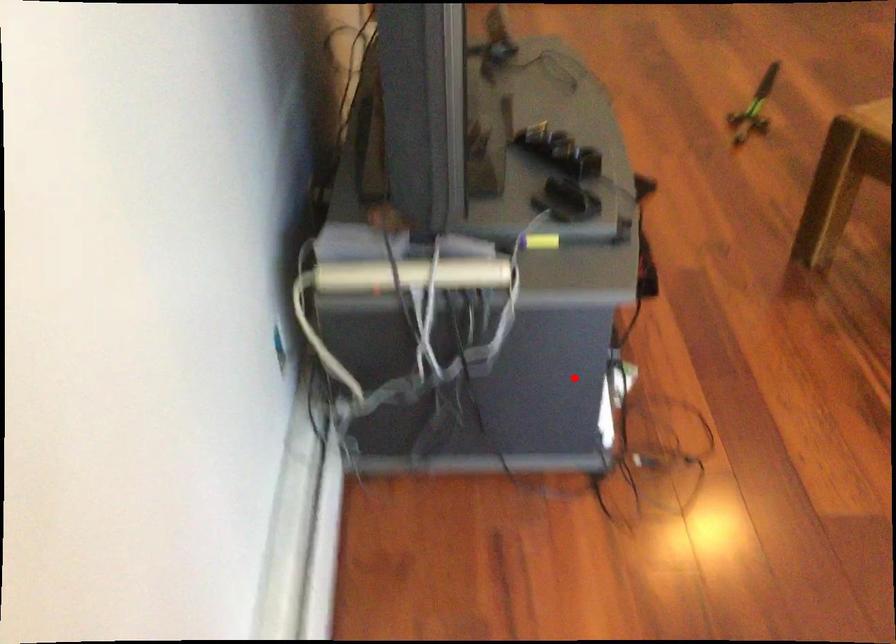
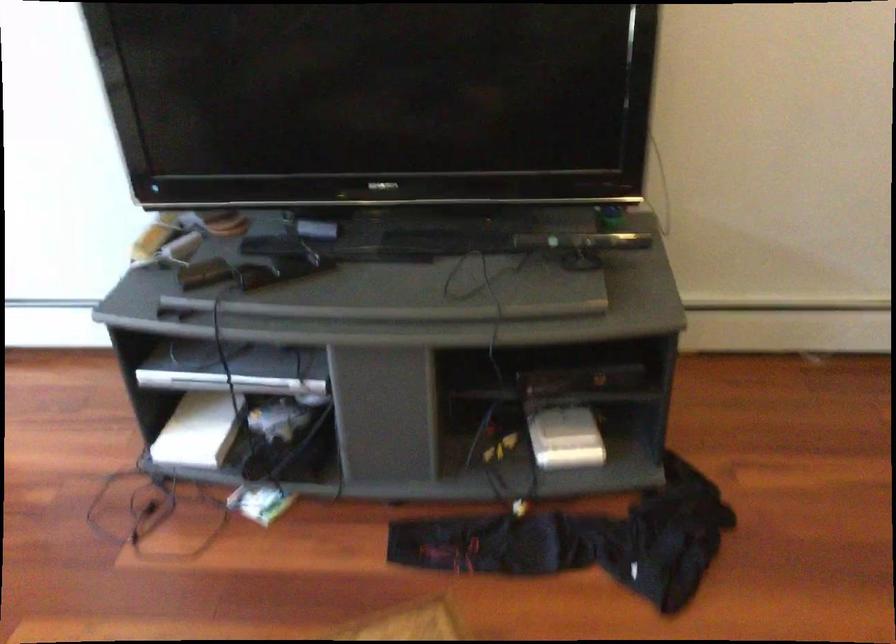
Question: I am providing you with two images of the same scene from different viewpoints. Image1 has a red point marked. In image2, the corresponding 3D location appears at what relative position? Reply with the corresponding letter.

Choices:
 (A) Closer
 (B) Farther

Answer: (B)